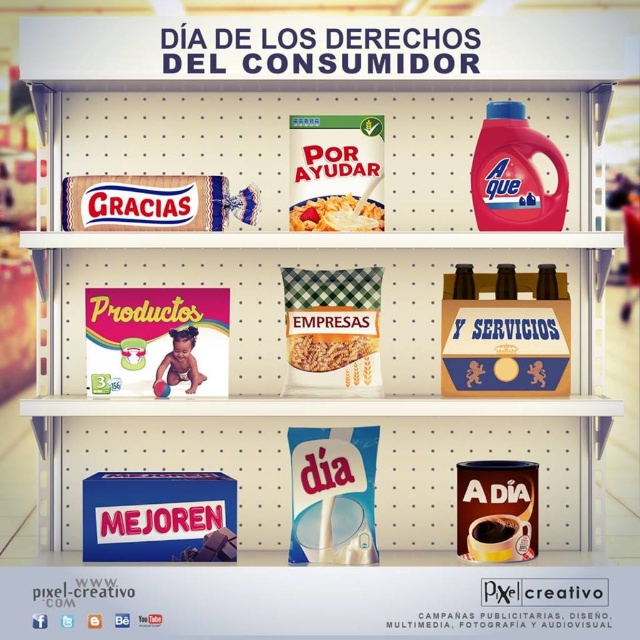
Question: Which point is farther to the camera?

Choices:
 (A) (124, 180)
 (B) (497, 497)
 (C) (342, 225)
 (D) (353, 224)

Answer: (D)

Question: Is matte red cereal box at upper center positioned behind matte plastic cereal box at center?

Choices:
 (A) no
 (B) yes

Answer: (B)

Question: Estimate the real-world distances between objects in this image. Which object is farther from the matte plastic cereal box at center?

Choices:
 (A) green checkered fabric bag of cereal at center
 (B) matte white chocolate bar at upper left
 (C) matte red cereal box at upper center

Answer: (B)

Question: Is gold metallic beer bottles at center right to the right of green checkered fabric bag of cereal at center from the viewer's perspective?

Choices:
 (A) yes
 (B) no

Answer: (A)

Question: Which of the following is the farthest from the observer?

Choices:
 (A) (291, 182)
 (B) (332, 202)
 (C) (378, 376)
 (D) (323, 356)

Answer: (A)

Question: Does matte plastic cereal box at center have a smaller size compared to matte cardboard cereal box at center?

Choices:
 (A) no
 (B) yes

Answer: (A)